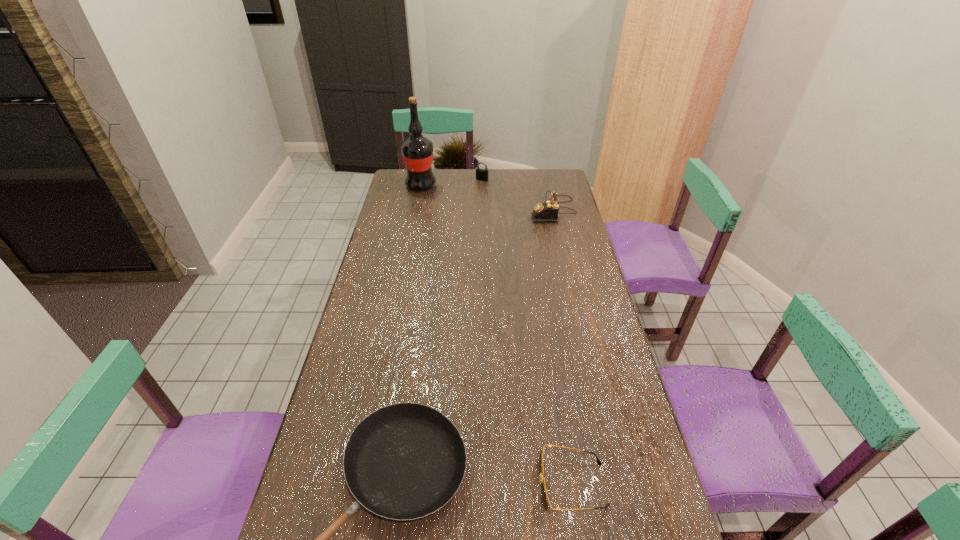
The height and width of the screenshot is (540, 960). In order to click on blank area located on the left of the third tallest object in this screenshot , I will do `click(447, 179)`.

Find the location of a particular element. The width and height of the screenshot is (960, 540). free space located 0.250m on the lenses of the sunglasses is located at coordinates (432, 485).

Where is `vacant space positioned 0.180m on the lenses of the sunglasses`? vacant space positioned 0.180m on the lenses of the sunglasses is located at coordinates (462, 485).

I want to click on vacant space located on the lenses of the sunglasses, so click(509, 485).

Locate an element on the screen. The width and height of the screenshot is (960, 540). wine bottle located in the far edge section of the desktop is located at coordinates (417, 151).

The width and height of the screenshot is (960, 540). In order to click on padlock situated at the far edge in this screenshot , I will do `click(481, 174)`.

Identify the location of object that is at the left edge. (417, 151).

You are a GUI agent. You are given a task and a screenshot of the screen. Output one action in this format:
    pyautogui.click(x=<x>, y=<y>)
    Task: Click on the telephone that is positioned at the right edge
    
    Given the screenshot: What is the action you would take?
    pyautogui.click(x=548, y=211)

Where is `sunglasses that is at the right edge`? sunglasses that is at the right edge is located at coordinates tap(545, 499).

This screenshot has height=540, width=960. I want to click on object present at the far left corner, so click(417, 151).